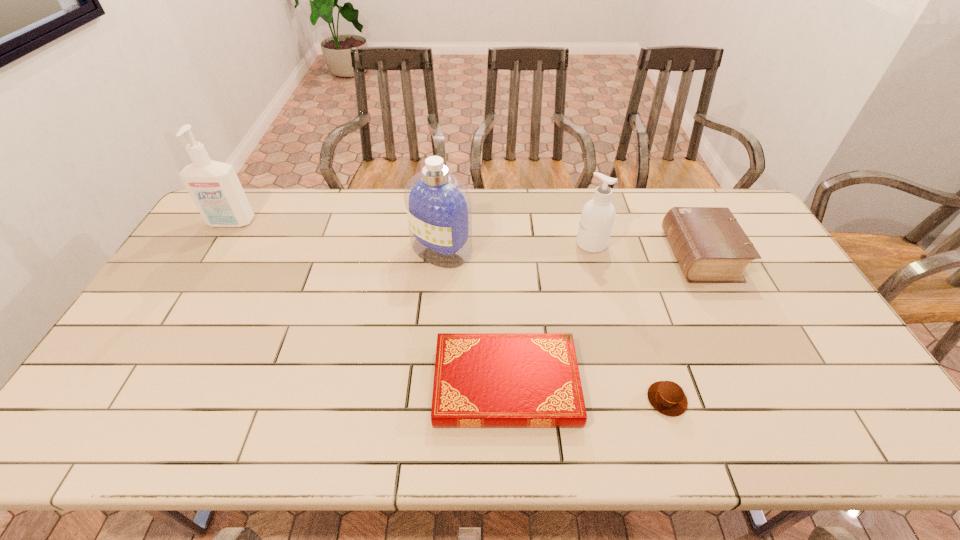
In order to click on object that is positioned at the far edge in this screenshot , I will do `click(214, 186)`.

At what (x,y) coordinates should I click in order to perform the action: click on muffin that is at the near edge. Please return your answer as a coordinate pair (x, y). Looking at the image, I should click on (667, 397).

Where is `hardback book positioned at the near edge`? The height and width of the screenshot is (540, 960). hardback book positioned at the near edge is located at coordinates (481, 380).

Locate an element on the screen. Image resolution: width=960 pixels, height=540 pixels. object positioned at the left edge is located at coordinates (214, 186).

The width and height of the screenshot is (960, 540). Identify the location of object located at the right edge. (710, 246).

Find the location of a particular element. The width and height of the screenshot is (960, 540). object located in the far left corner section of the desktop is located at coordinates (214, 186).

In the image, there is a desktop. At what (x,y) coordinates should I click in order to perform the action: click on free space at the far edge. Please return your answer as a coordinate pair (x, y). This screenshot has height=540, width=960. Looking at the image, I should click on (633, 228).

You are a GUI agent. You are given a task and a screenshot of the screen. Output one action in this format:
    pyautogui.click(x=<x>, y=<y>)
    Task: Click on the free region at the near edge of the desktop
    
    Given the screenshot: What is the action you would take?
    pyautogui.click(x=658, y=421)

This screenshot has height=540, width=960. Find the location of `free space at the left edge of the desktop`. free space at the left edge of the desktop is located at coordinates (216, 238).

The height and width of the screenshot is (540, 960). In order to click on vacant space at the far right corner of the desktop in this screenshot , I will do `click(739, 205)`.